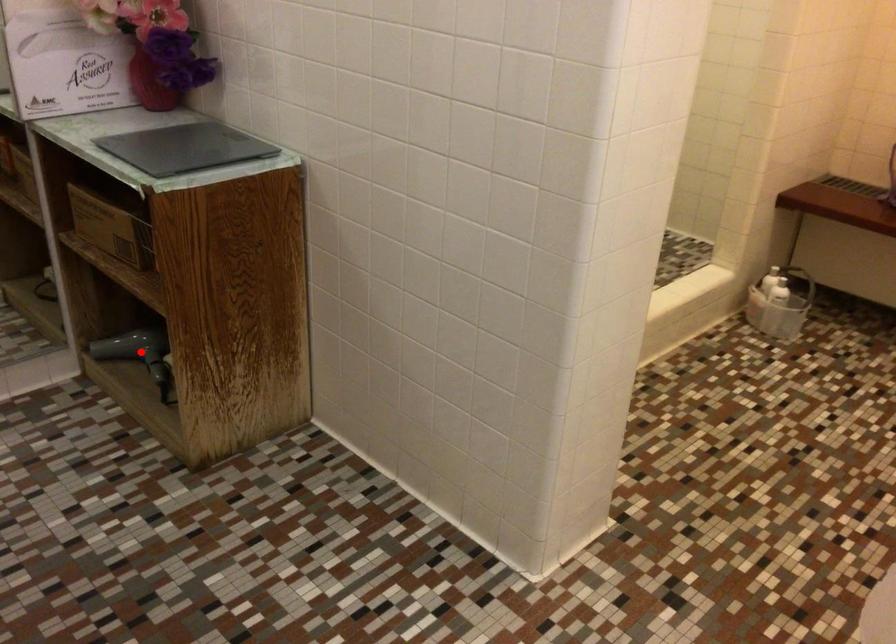
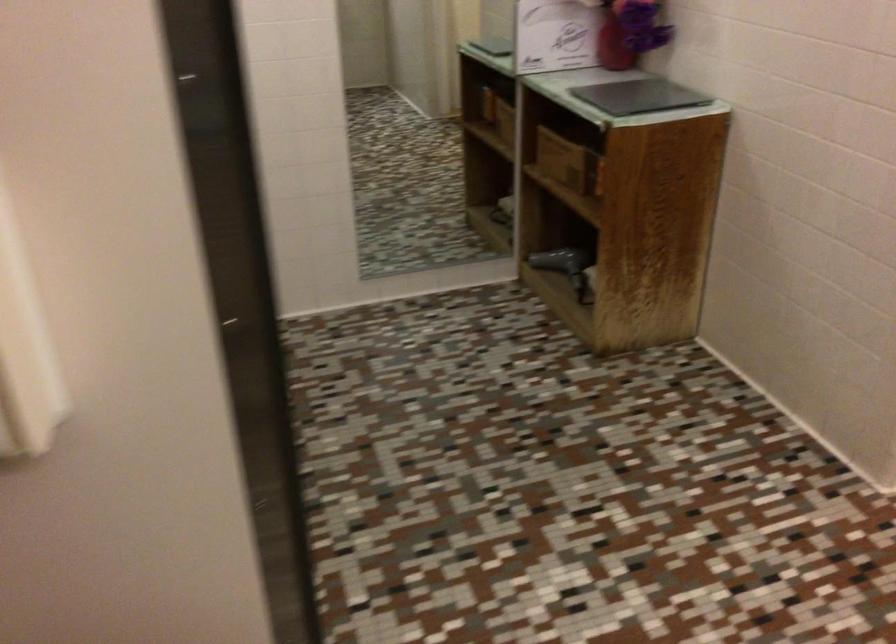
Where in the second image is the point corresponding to the highlighted location from the first image?

(564, 266)